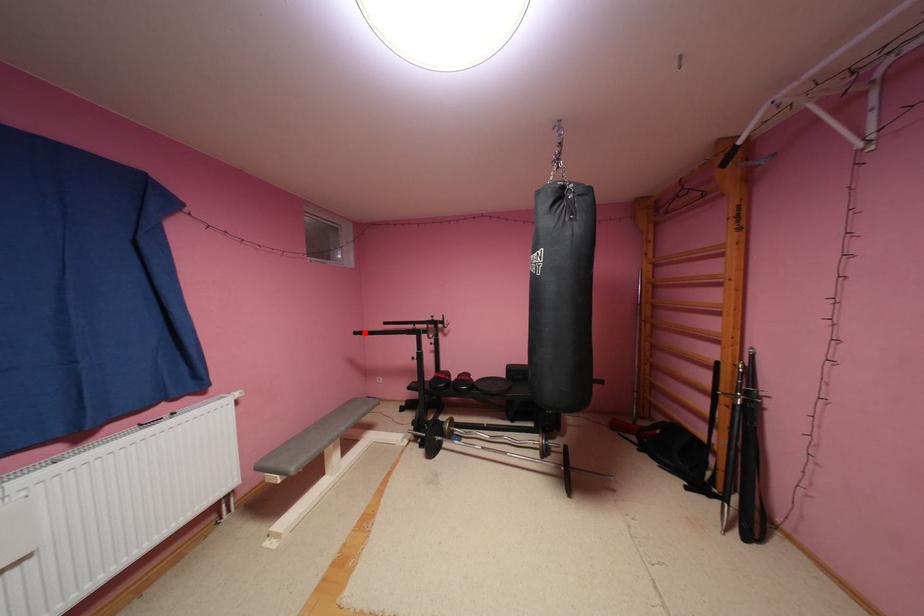
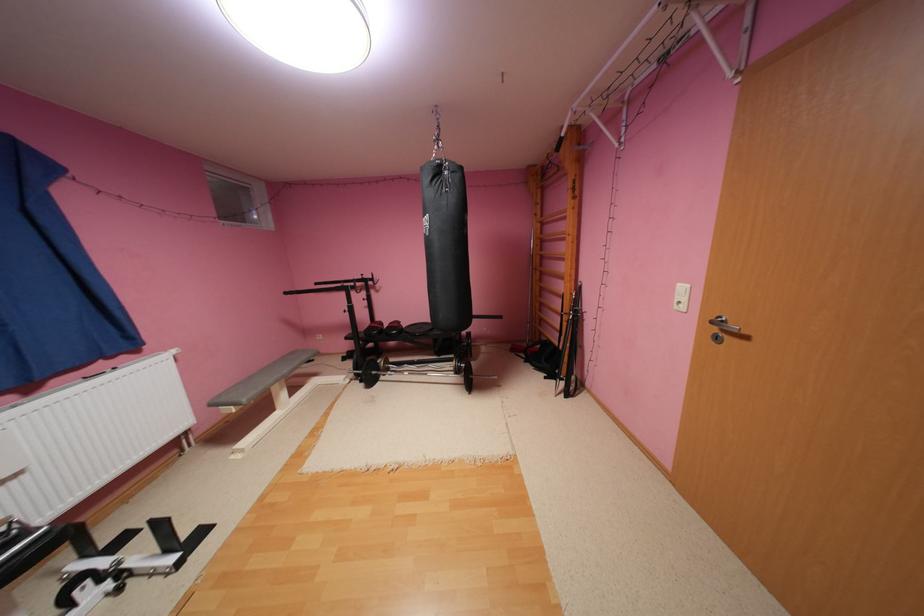
Question: I am providing you with two images of the same scene from different viewpoints. Image1 has a red point marked. In image2, the corresponding 3D location appears at what relative position? Reply with the corresponding letter.

Choices:
 (A) Closer
 (B) Farther

Answer: (A)